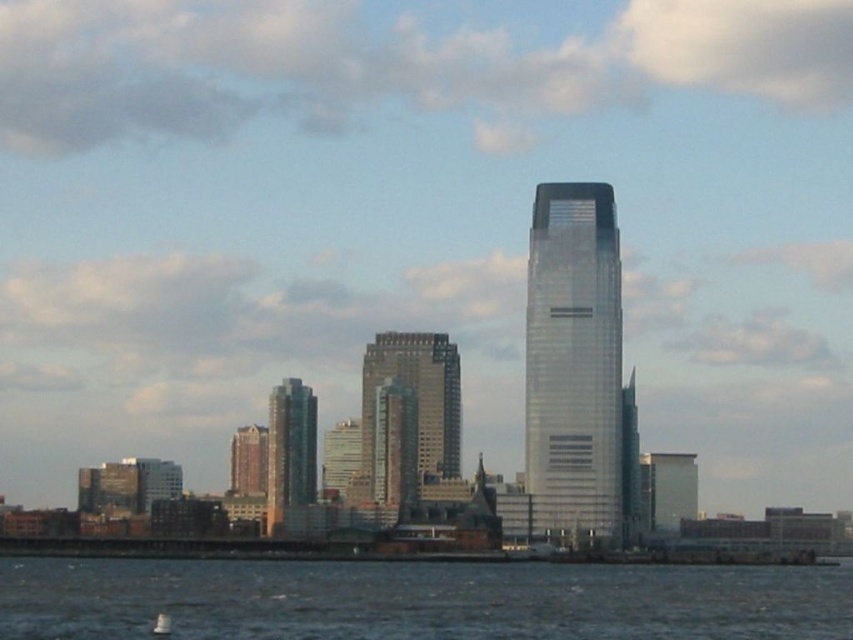
Question: Can you confirm if dark blue water at lower center is positioned to the left of smooth glass skyscraper at center?

Choices:
 (A) yes
 (B) no

Answer: (A)

Question: Is gray glass building at center positioned behind metallic glass building at center?

Choices:
 (A) no
 (B) yes

Answer: (A)

Question: Which point is farther from the camera taking this photo?

Choices:
 (A) (309, 452)
 (B) (741, 589)
 (C) (163, 612)
 (D) (547, 378)

Answer: (B)

Question: Among these points, which one is farthest from the camera?

Choices:
 (A) (653, 483)
 (B) (306, 458)
 (C) (157, 624)
 (D) (585, 248)

Answer: (C)

Question: Which point appears farthest from the camera in this image?

Choices:
 (A) (532, 483)
 (B) (444, 394)
 (C) (784, 616)

Answer: (C)

Question: From the image, what is the correct spatial relationship of silver glass skyscraper at center in relation to white plastic boat at lower left?

Choices:
 (A) left
 (B) right

Answer: (B)